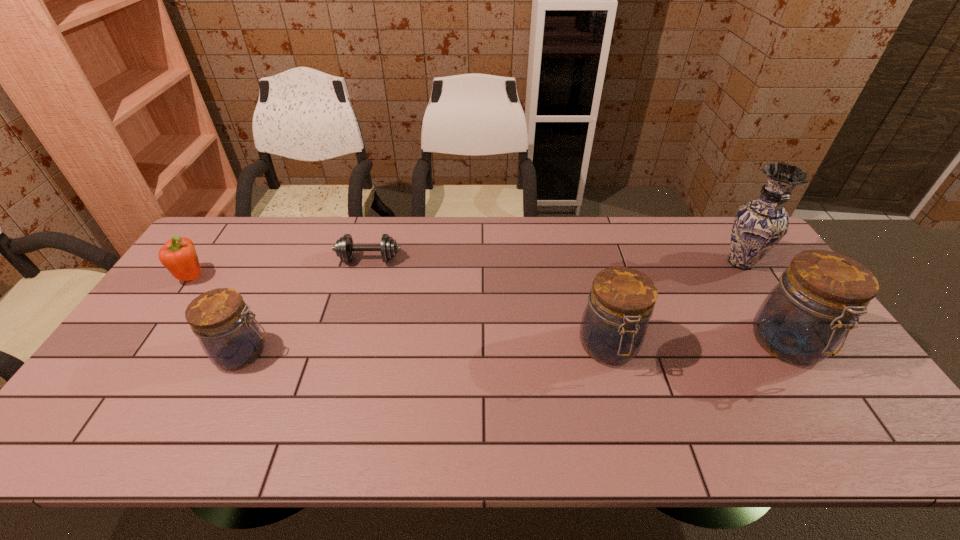
Find the location of a particular element. Image resolution: width=960 pixels, height=540 pixels. the fifth object from right to left is located at coordinates tap(231, 337).

What are the coordinates of `the leftmost jar` in the screenshot? It's located at (231, 337).

This screenshot has width=960, height=540. What are the coordinates of `the second tallest jar` in the screenshot? It's located at (614, 324).

Locate an element on the screen. the fourth object from left to right is located at coordinates (614, 324).

The width and height of the screenshot is (960, 540). What are the coordinates of `the rightmost jar` in the screenshot? It's located at (808, 314).

Find the location of a particular element. the tallest object is located at coordinates (759, 225).

Where is `dumbbell`? dumbbell is located at coordinates (344, 248).

I want to click on the third object from left to right, so click(x=344, y=248).

Locate an element on the screen. pepper is located at coordinates (178, 256).

Where is `vacant space positioned on the lid of the leftmost jar`? vacant space positioned on the lid of the leftmost jar is located at coordinates (324, 353).